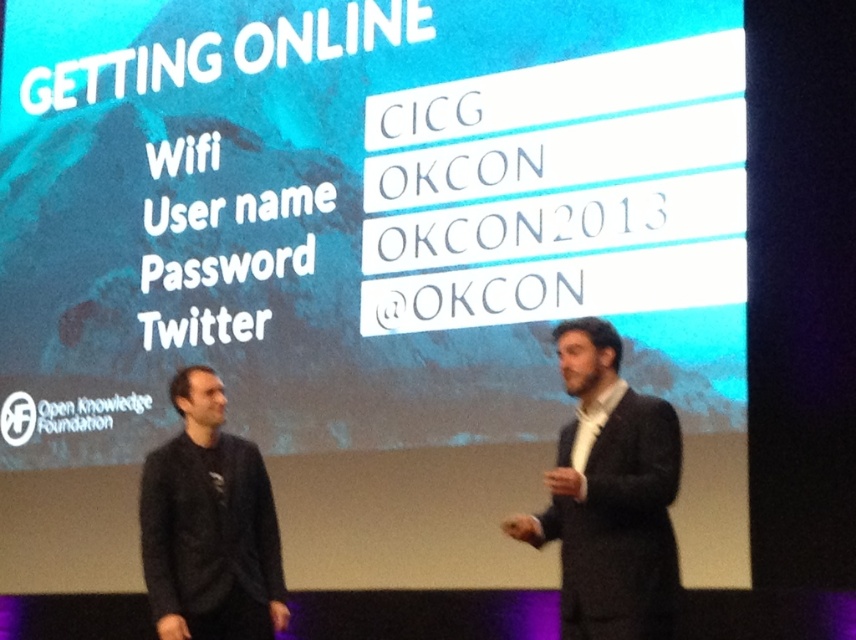
Question: Which point is closer to the camera taking this photo?

Choices:
 (A) (367, 276)
 (B) (274, 561)

Answer: (B)

Question: Is white matte projection screen at upper center further to camera compared to black wool suit at right?

Choices:
 (A) yes
 (B) no

Answer: (A)

Question: Does black wool suit at right appear on the right side of black matte sweater at left?

Choices:
 (A) yes
 (B) no

Answer: (A)

Question: Which of these objects is positioned farthest from the black matte sweater at left?

Choices:
 (A) black wool suit at right
 (B) white matte projection screen at upper center

Answer: (A)

Question: Does white matte projection screen at upper center appear on the right side of black matte sweater at left?

Choices:
 (A) yes
 (B) no

Answer: (A)

Question: Which of the following is the farthest from the observer?

Choices:
 (A) (566, 492)
 (B) (189, 384)
 (C) (34, 68)

Answer: (C)